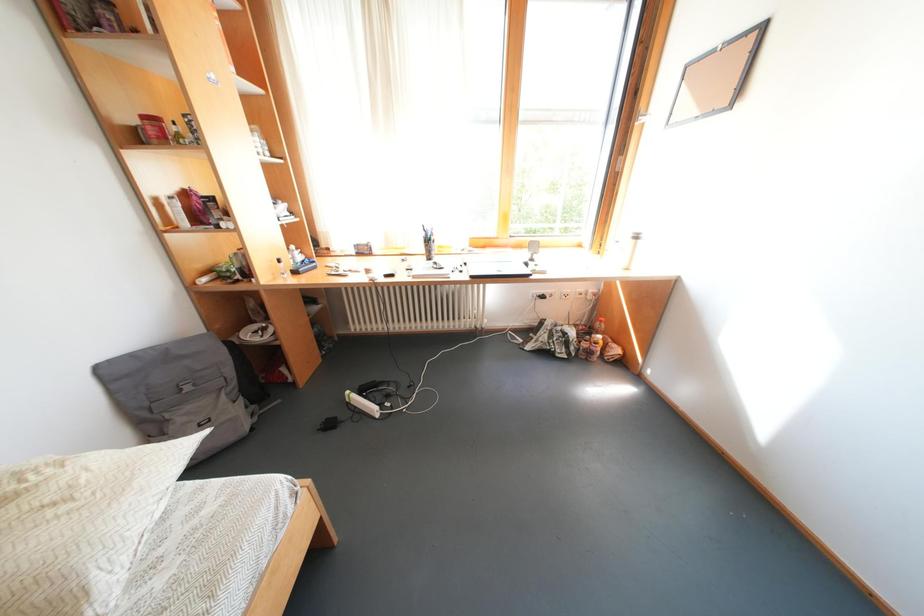
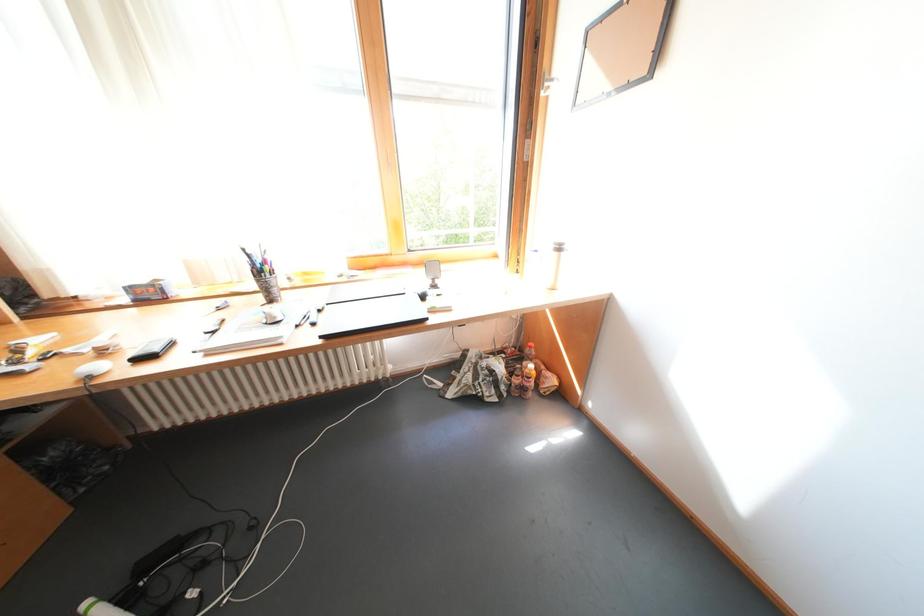
Question: The camera is either moving clockwise (left) or counter-clockwise (right) around the object. The first image is from the beginning of the video and the second image is from the end. Is the camera moving left or right when shooting the video?

Choices:
 (A) Left
 (B) Right

Answer: (A)